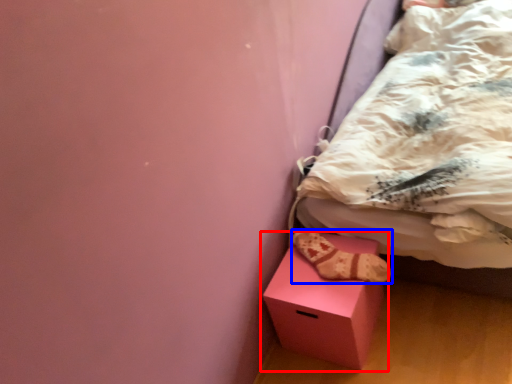
Question: Among these objects, which one is nearest to the camera, box (highlighted by a red box) or footwear (highlighted by a blue box)?

Choices:
 (A) box
 (B) footwear

Answer: (A)